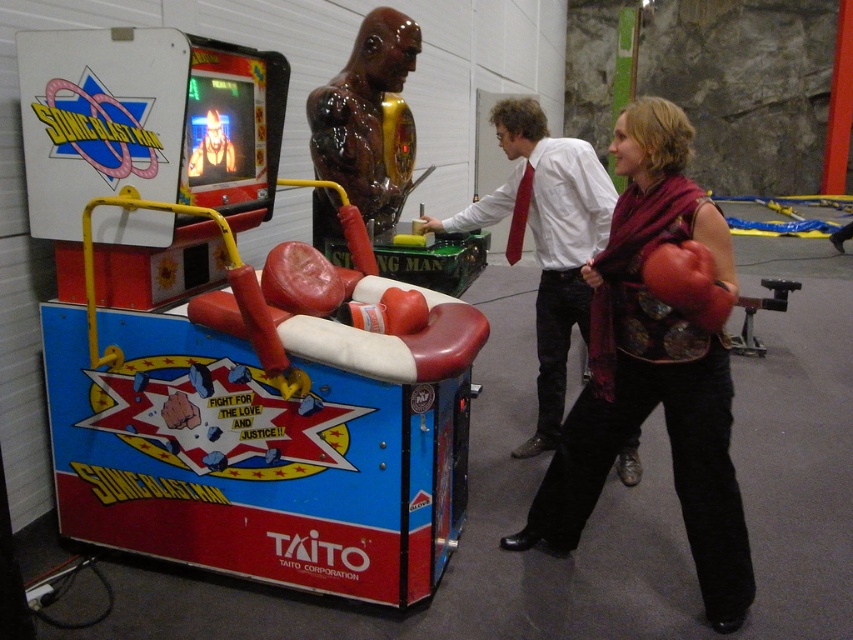
Question: Estimate the real-world distances between objects in this image. Which object is farther from the matte red boxing glove at center?

Choices:
 (A) white glossy shirt at center
 (B) glossy metallic figure at center
 (C) leather boxing glove at center

Answer: (B)

Question: Which point is closer to the camera?

Choices:
 (A) (625, 304)
 (B) (354, 136)
 (C) (729, 298)
 (D) (502, 212)

Answer: (C)

Question: From the image, what is the correct spatial relationship of white glossy shirt at center in relation to matte red boxing glove at center?

Choices:
 (A) right
 (B) left

Answer: (B)

Question: Which point appears farthest from the camera in this image?

Choices:
 (A) (363, 56)
 (B) (663, 266)

Answer: (A)

Question: Is white glossy shirt at center wider than matte red boxing glove at center?

Choices:
 (A) no
 (B) yes

Answer: (B)

Question: Is white glossy shirt at center behind matte red boxing glove at center?

Choices:
 (A) no
 (B) yes

Answer: (B)